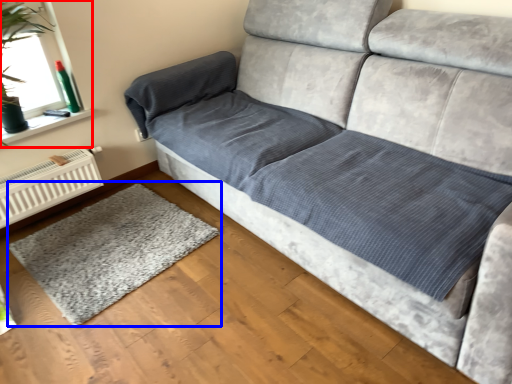
Question: Which point is further to the camera, window screen (highlighted by a red box) or mat (highlighted by a blue box)?

Choices:
 (A) window screen
 (B) mat

Answer: (A)